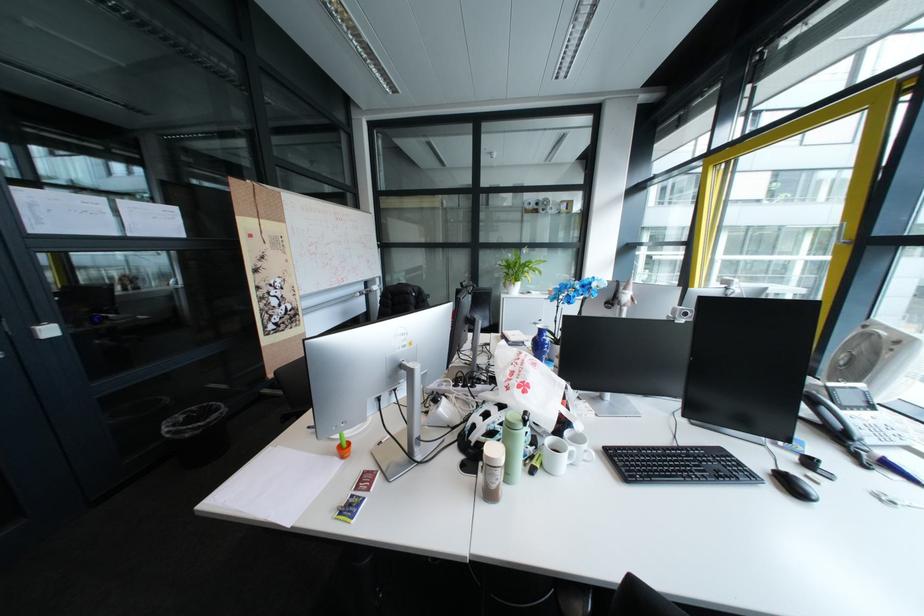
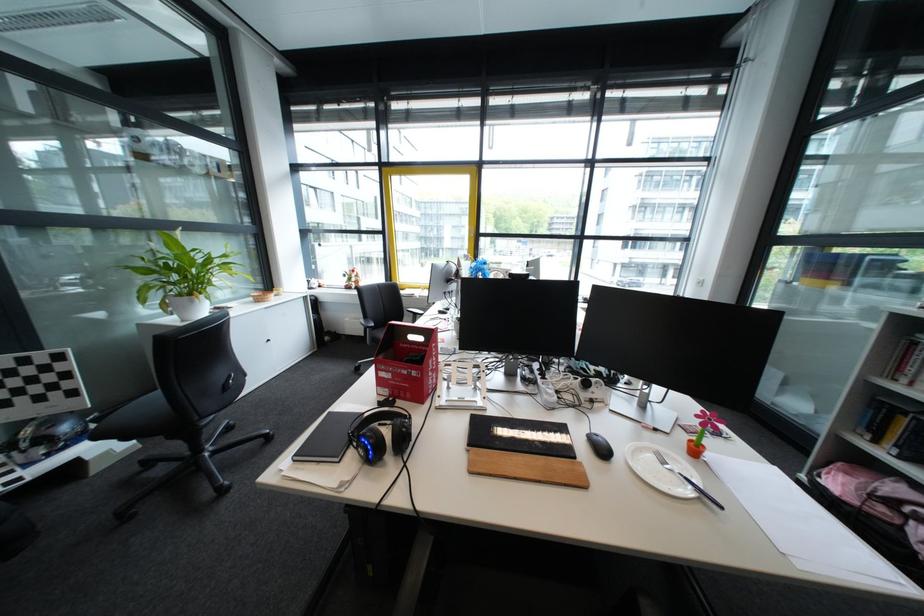
Question: I am providing you with two images of the same scene from different viewpoints. Please identify which objects are invisible in image2.

Choices:
 (A) blue and white vase
 (B) black chair sitting surface
 (C) black computer mouse
 (D) paper towel dispenser lever

Answer: (A)